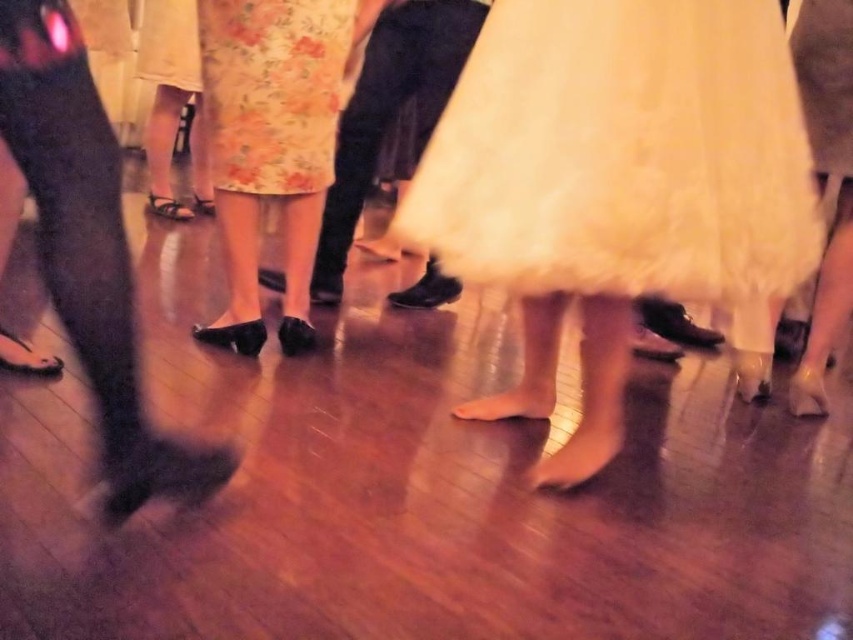
Who is higher up, white satin dress at center or floral fabric skirt at upper left?

floral fabric skirt at upper left is above.

Between white satin dress at center and floral fabric skirt at upper left, which one has more height?

With more height is white satin dress at center.

Where is `white satin dress at center`? white satin dress at center is located at coordinates (621, 154).

Can you confirm if floral fabric dress at center is positioned above floral fabric skirt at upper left?

No, floral fabric dress at center is not above floral fabric skirt at upper left.

Does floral fabric dress at center have a lesser height compared to floral fabric skirt at upper left?

No, floral fabric dress at center is not shorter than floral fabric skirt at upper left.

The width and height of the screenshot is (853, 640). Identify the location of floral fabric dress at center. (271, 90).

Does white satin dress at center have a lesser width compared to floral fabric skirt at center?

No.

Who is positioned more to the left, white satin dress at center or floral fabric skirt at center?

From the viewer's perspective, floral fabric skirt at center appears more on the left side.

Is point (608, 196) more distant than point (259, 26)?

That is False.

Locate an element on the screen. The height and width of the screenshot is (640, 853). white satin dress at center is located at coordinates (621, 154).